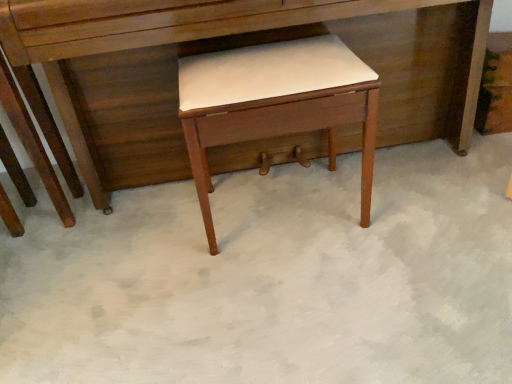
Locate an element on the screen. This screenshot has height=384, width=512. free spot in front of matte wood desk at center is located at coordinates (298, 294).